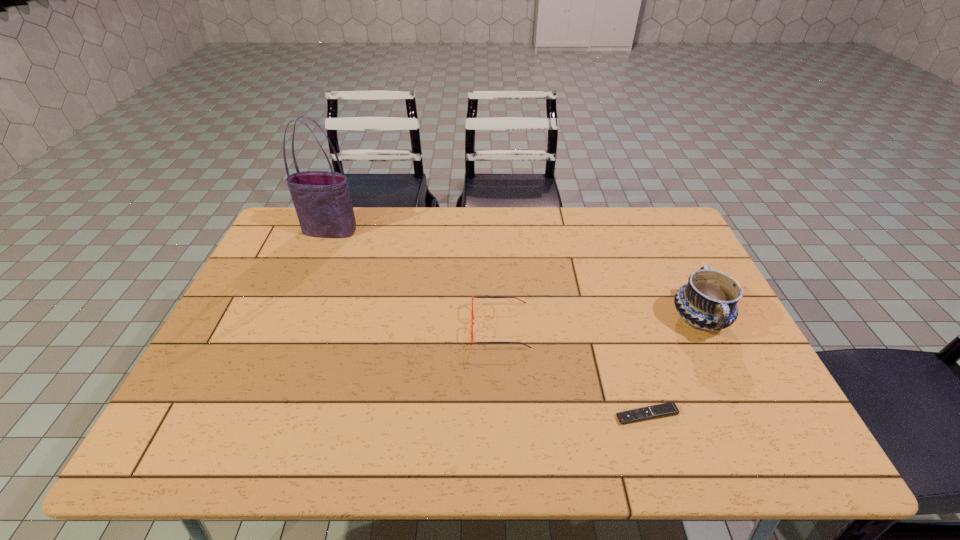
The image size is (960, 540). Identify the location of free space between the remote control and the farthest object. (489, 323).

Find the location of a particular element. free space between the shortest object and the pottery is located at coordinates (673, 367).

Where is `vacant space that's between the spectacles and the farthest object`? vacant space that's between the spectacles and the farthest object is located at coordinates (416, 279).

Image resolution: width=960 pixels, height=540 pixels. I want to click on vacant space in between the third object from left to right and the leftmost object, so click(x=489, y=323).

Find the location of a particular element. vacant space that is in between the third tallest object and the shortest object is located at coordinates (573, 371).

Where is `unoccupied area between the leftmost object and the third shortest object`? unoccupied area between the leftmost object and the third shortest object is located at coordinates (515, 275).

Locate an element on the screen. object identified as the third closest to the spectacles is located at coordinates (322, 200).

Locate an element on the screen. Image resolution: width=960 pixels, height=540 pixels. object that is the third closest to the farthest object is located at coordinates (708, 301).

In order to click on vacant area in the image that satisfies the following two spatial constraints: 1. on the back side of the nearest object; 2. on the front-facing side of the third object from right to left in this screenshot , I will do `click(620, 327)`.

Locate an element on the screen. This screenshot has height=540, width=960. free spot that satisfies the following two spatial constraints: 1. on the front side of the remote control; 2. on the right side of the farthest object is located at coordinates (255, 415).